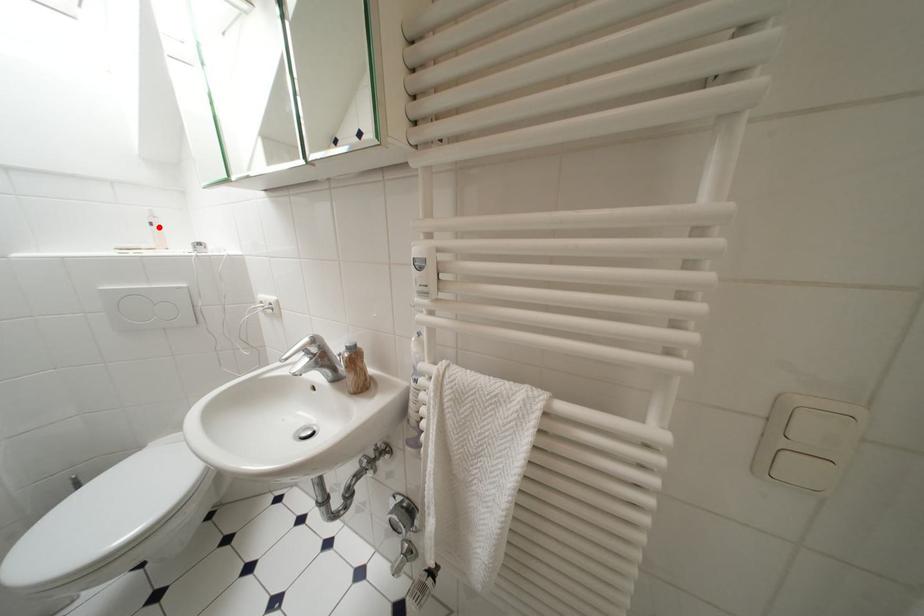
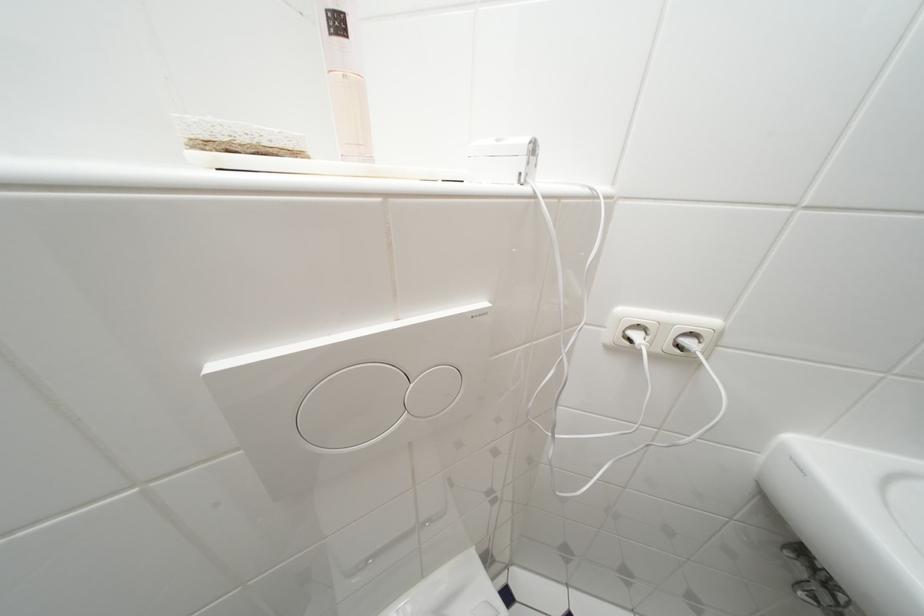
Find the pixel in the second image that matches the highlighted location in the first image.

(345, 26)